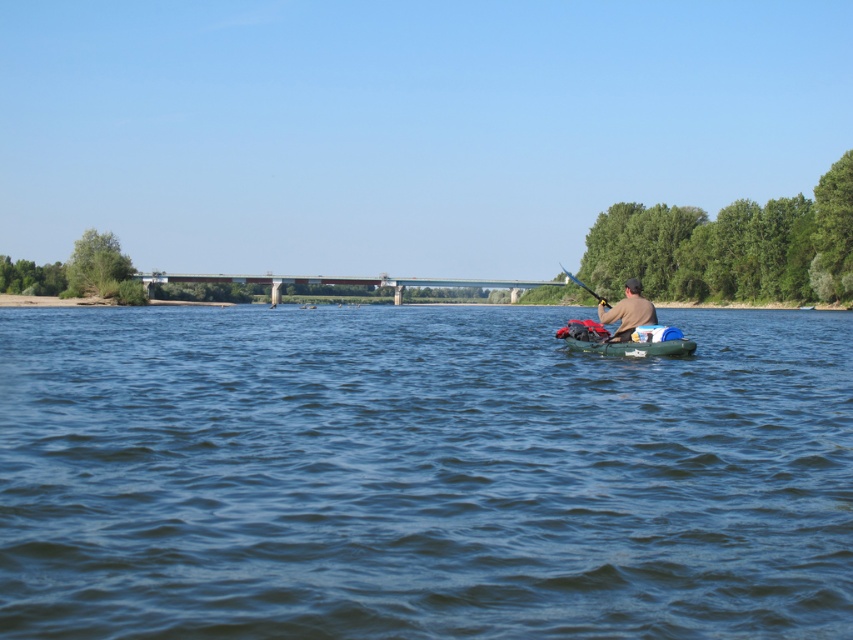
Which is more to the left, brown leather jacket at center or metallic blue paddle at center-right?

From the viewer's perspective, brown leather jacket at center appears more on the left side.

Between brown leather jacket at center and metallic blue paddle at center-right, which one appears on the right side from the viewer's perspective?

metallic blue paddle at center-right is more to the right.

Which is behind, point (634, 308) or point (567, 275)?

The point (567, 275) is more distant.

You are a GUI agent. You are given a task and a screenshot of the screen. Output one action in this format:
    pyautogui.click(x=<x>, y=<y>)
    Task: Click on the brown leather jacket at center
    The width and height of the screenshot is (853, 640).
    Given the screenshot: What is the action you would take?
    pyautogui.click(x=628, y=310)

Can you confirm if blue water at center is positioned below metallic blue paddle at center-right?

Yes.

Does blue water at center have a lesser height compared to metallic blue paddle at center-right?

Yes, blue water at center is shorter than metallic blue paddle at center-right.

The height and width of the screenshot is (640, 853). Find the location of `blue water at center`. blue water at center is located at coordinates (421, 474).

Can you confirm if blue water at center is positioned to the right of translucent blue kayak at center?

Incorrect, blue water at center is not on the right side of translucent blue kayak at center.

Does blue water at center have a greater width compared to translucent blue kayak at center?

Indeed, blue water at center has a greater width compared to translucent blue kayak at center.

Does point (399, 413) lie behind point (641, 324)?

No, (399, 413) is closer to viewer.

The width and height of the screenshot is (853, 640). Identify the location of blue water at center. (421, 474).